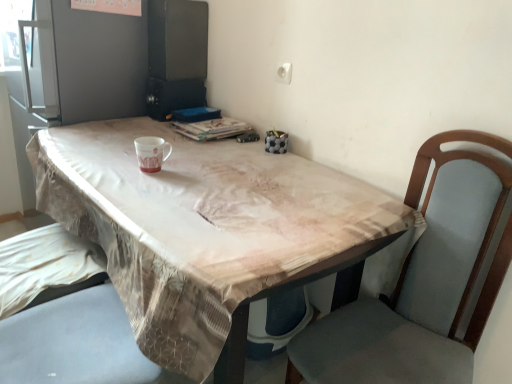
This screenshot has height=384, width=512. I want to click on vacant space situated above brown fabric table at center (from a real-world perspective), so click(196, 173).